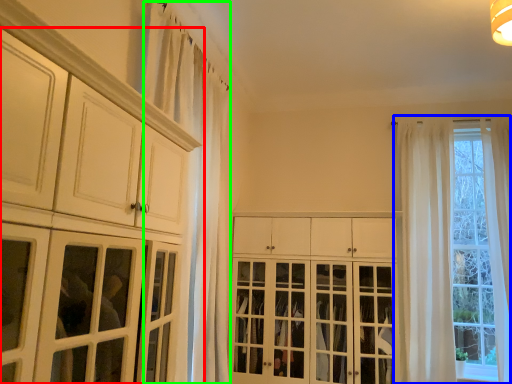
Question: Which is nearer to the cabinetry (highlighted by a red box)? window (highlighted by a blue box) or curtain (highlighted by a green box).

Choices:
 (A) window
 (B) curtain

Answer: (B)